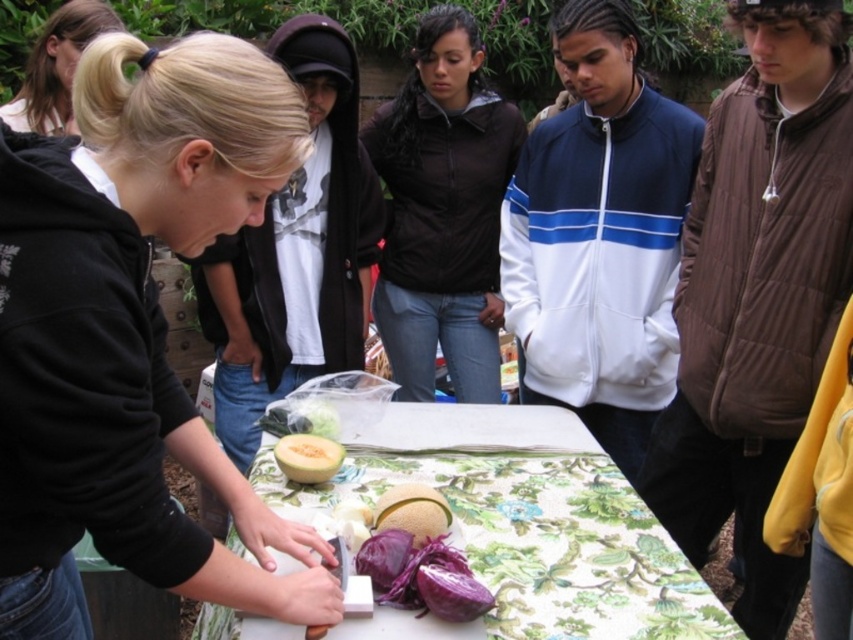
From the picture: You are a photographer standing at the edge of the scene. You want to take a photo that includes both the blonde hair at upper left and the smooth yellow melon at center. Given that your camera has a maximum focus range of 4 feet, will you be able to capture both subjects in focus without moving your position?

The blonde hair at upper left and smooth yellow melon at center are 4.80 feet apart from each other. Since the camera can only focus within 4 feet, the distance between them exceeds the focus range. Therefore, you cannot capture both in focus without moving.

You are standing at the edge of the table looking towards the center. Which of the two points, point (x=775, y=605) or point (x=323, y=449), is closer to you?

Point (x=775, y=605) is closer to you because it is further to the viewer than point (x=323, y=449).

You are standing at the center of the table and want to reach the brown puffy vest at right. In which direction should you move?

You should move to the right direction to reach the brown puffy vest at right since it is located at the right side of the table.